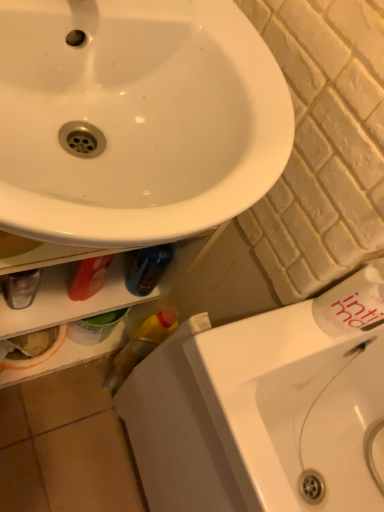
Question: Is white glossy sink at lower right positioned in front of white textured brick at center right?

Choices:
 (A) yes
 (B) no

Answer: (B)

Question: Does white glossy sink at lower right contain white textured brick at center right?

Choices:
 (A) yes
 (B) no

Answer: (B)

Question: Considering the relative sizes of white glossy sink at lower right and white textured brick at center right in the image provided, is white glossy sink at lower right smaller than white textured brick at center right?

Choices:
 (A) yes
 (B) no

Answer: (B)

Question: Considering the relative sizes of white glossy sink at lower right and white textured brick at center right in the image provided, is white glossy sink at lower right thinner than white textured brick at center right?

Choices:
 (A) yes
 (B) no

Answer: (B)

Question: Is white glossy sink at lower right outside of white textured brick at center right?

Choices:
 (A) yes
 (B) no

Answer: (A)

Question: Is white glossy sink at upper left wider or thinner than white glossy sink at lower right?

Choices:
 (A) thin
 (B) wide

Answer: (A)

Question: Is white glossy sink at upper left in front of or behind white glossy sink at lower right in the image?

Choices:
 (A) behind
 (B) front

Answer: (B)

Question: In terms of height, does white glossy sink at upper left look taller or shorter compared to white glossy sink at lower right?

Choices:
 (A) tall
 (B) short

Answer: (B)

Question: Is white glossy sink at upper left spatially inside white glossy sink at lower right, or outside of it?

Choices:
 (A) outside
 (B) inside

Answer: (A)

Question: In the image, is white textured brick at center right positioned in front of or behind white matte bottle at upper right?

Choices:
 (A) front
 (B) behind

Answer: (A)

Question: Does point 329,111 appear closer or farther from the camera than point 380,300?

Choices:
 (A) closer
 (B) farther

Answer: (A)

Question: From a real-world perspective, is white textured brick at center right above or below white matte bottle at upper right?

Choices:
 (A) above
 (B) below

Answer: (B)

Question: Is white textured brick at center right inside or outside of white matte bottle at upper right?

Choices:
 (A) inside
 (B) outside

Answer: (B)

Question: In terms of size, does white glossy sink at lower right appear bigger or smaller than white matte bottle at upper right?

Choices:
 (A) small
 (B) big

Answer: (B)

Question: Considering the relative positions of white glossy sink at lower right and white matte bottle at upper right in the image provided, is white glossy sink at lower right to the left or to the right of white matte bottle at upper right?

Choices:
 (A) left
 (B) right

Answer: (B)